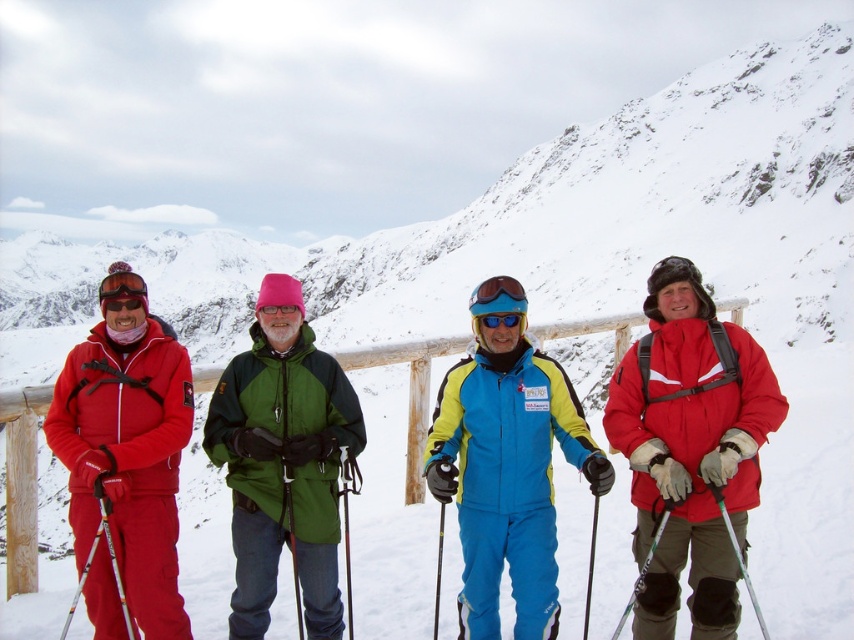
You are a photographer trying to capture a clear shot of the blue matte goggles at center and the matte black ski pole at left. Since the ski pole is blocking the view of the goggles, can you adjust your position to move the ski pole out of the frame while keeping both objects visible?

The matte black ski pole at left is behind the blue matte goggles at center, so you can move your position slightly forward or sideways to bring the goggles forward and keep both visible without the pole blocking them.

You are a photographer trying to capture a group photo of the matte red ski suit at left and the matte black ski pole at left. If you want to ensure both subjects are fully visible in the frame, which subject requires a wider angle lens to accommodate their size?

The matte red ski suit at left requires a wider angle lens because its width is larger than the matte black ski pole at left.

You are a photographer trying to capture the matte red ski suit at left and the blue matte goggles at center in a single photo. Which one would appear larger in the photo?

The matte red ski suit at left appears larger in the photo because it is closer to the camera than the blue matte goggles at center.